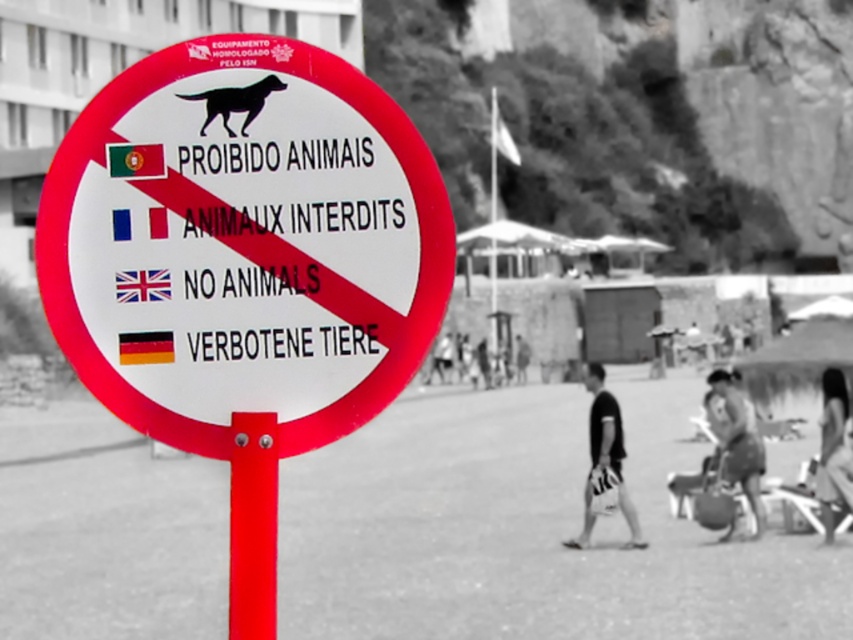
What do you see at coordinates (531, 529) in the screenshot?
I see `smooth sand beach at center` at bounding box center [531, 529].

Can you confirm if smooth sand beach at center is wider than smooth fabric shirt at lower right?

Indeed, smooth sand beach at center has a greater width compared to smooth fabric shirt at lower right.

At what (x,y) coordinates should I click in order to perform the action: click on smooth sand beach at center. Please return your answer as a coordinate pair (x, y). The width and height of the screenshot is (853, 640). Looking at the image, I should click on (531, 529).

Is red plastic pole at center below matte black bag at lower right?

No.

Which is more to the right, red plastic pole at center or matte black bag at lower right?

matte black bag at lower right is more to the right.

Which is in front, point (258, 419) or point (749, 481)?

Point (258, 419)

Where is `red plastic pole at center`? red plastic pole at center is located at coordinates (252, 525).

Which is below, smooth sand beach at center or matte black bag at lower right?

smooth sand beach at center is lower down.

Who is more forward, [444,499] or [729,404]?

Positioned in front is point [729,404].

Which is in front, point (772, 528) or point (757, 477)?

Point (772, 528) is in front.

Where is `smooth sand beach at center`? The image size is (853, 640). smooth sand beach at center is located at coordinates point(531,529).